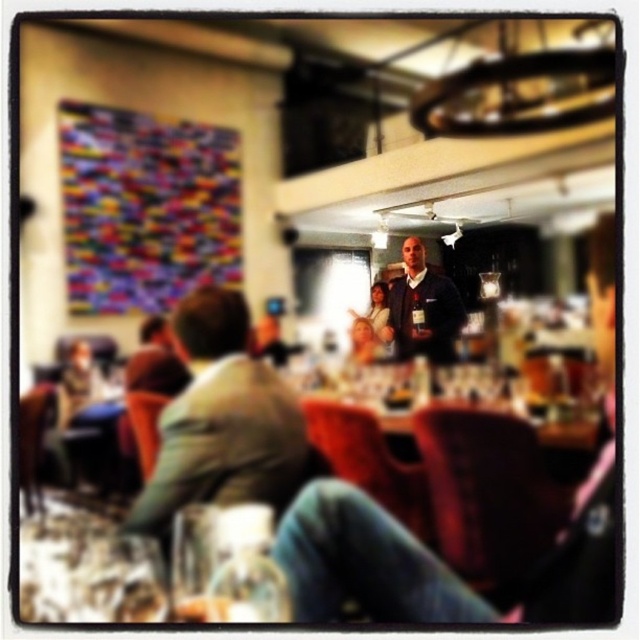
Question: Considering the relative positions of green fabric jacket at center and clear glass at lower left in the image provided, where is green fabric jacket at center located with respect to clear glass at lower left?

Choices:
 (A) below
 (B) above

Answer: (B)

Question: Is green fabric jacket at center bigger than clear glass at lower left?

Choices:
 (A) no
 (B) yes

Answer: (B)

Question: Which point appears farthest from the camera in this image?

Choices:
 (A) (305, 477)
 (B) (221, 611)

Answer: (A)

Question: Which of the following is the closest to the observer?

Choices:
 (A) green fabric jacket at center
 (B) clear glass at lower left
 (C) dark blue shirt at center

Answer: (B)

Question: Which point appears closest to the camera in this image?

Choices:
 (A) (397, 337)
 (B) (200, 605)
 (C) (179, 445)

Answer: (B)

Question: Can you confirm if green fabric jacket at center is positioned below dark blue shirt at center?

Choices:
 (A) yes
 (B) no

Answer: (A)